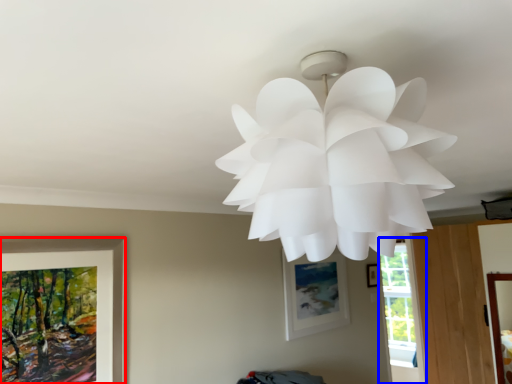
Question: Which object appears closest to the camera in this image, picture frame (highlighted by a red box) or window (highlighted by a blue box)?

Choices:
 (A) picture frame
 (B) window

Answer: (A)